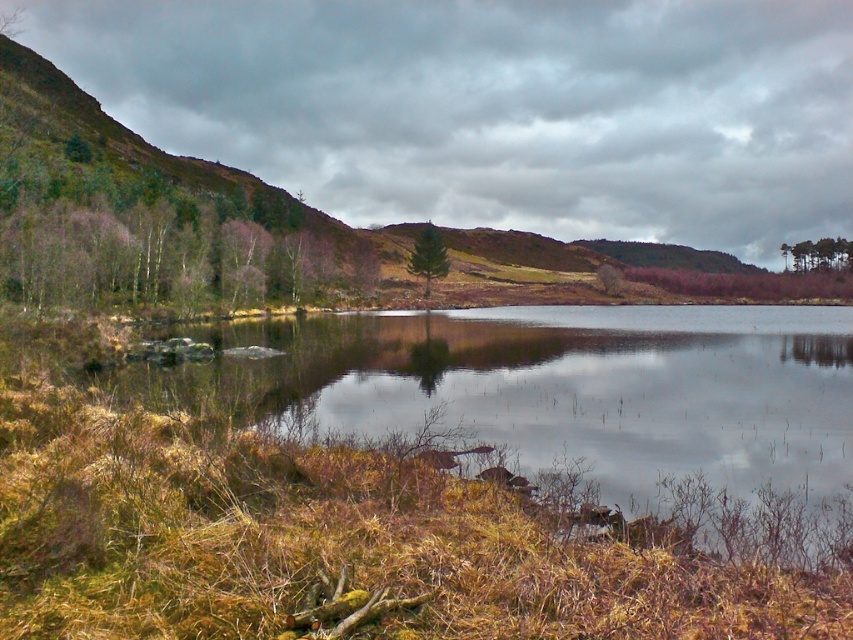
Question: Which object appears farthest from the camera in this image?

Choices:
 (A) green matte tree at center
 (B) green matte tree at upper right
 (C) smooth reflective water at lower center

Answer: (B)

Question: Does smooth reflective water at lower center appear on the right side of green matte tree at upper right?

Choices:
 (A) no
 (B) yes

Answer: (A)

Question: Which point appears farthest from the camera in this image?

Choices:
 (A) (825, 257)
 (B) (672, 314)
 (C) (432, 257)

Answer: (A)

Question: Can you confirm if green matte tree at upper right is positioned to the right of green matte tree at center?

Choices:
 (A) yes
 (B) no

Answer: (A)

Question: Is smooth reflective water at lower center behind green matte tree at center?

Choices:
 (A) yes
 (B) no

Answer: (B)

Question: Which of the following is the closest to the observer?

Choices:
 (A) (834, 243)
 (B) (421, 264)
 (C) (352, 337)

Answer: (C)